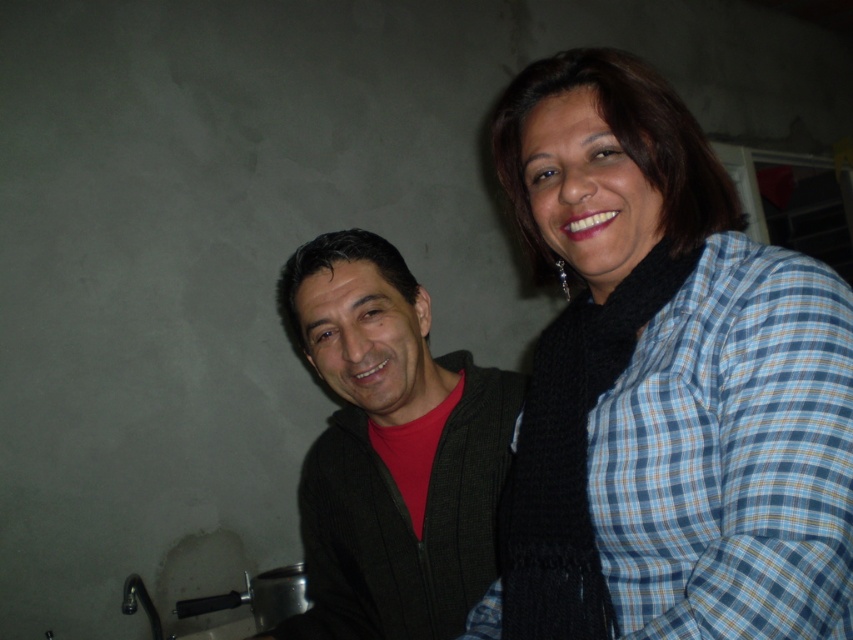
Does blue plaid shirt at upper right have a greater height compared to dark green sweater at center?

Indeed, blue plaid shirt at upper right has a greater height compared to dark green sweater at center.

Which is in front, point (581, 145) or point (379, 488)?

Point (581, 145) is in front.

Image resolution: width=853 pixels, height=640 pixels. I want to click on blue plaid shirt at upper right, so click(665, 385).